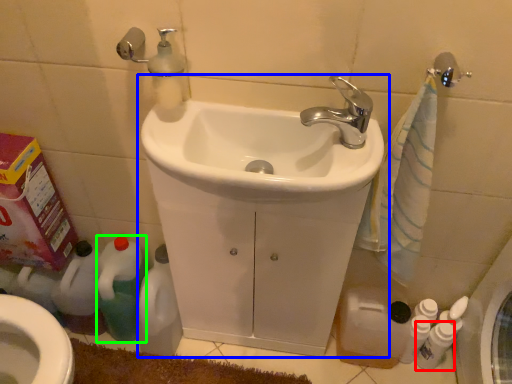
Question: Based on their relative distances, which object is farther from cleaning product (highlighted by a red box)? Choose from sink (highlighted by a blue box) and cleaning product (highlighted by a green box).

Choices:
 (A) sink
 (B) cleaning product

Answer: (B)